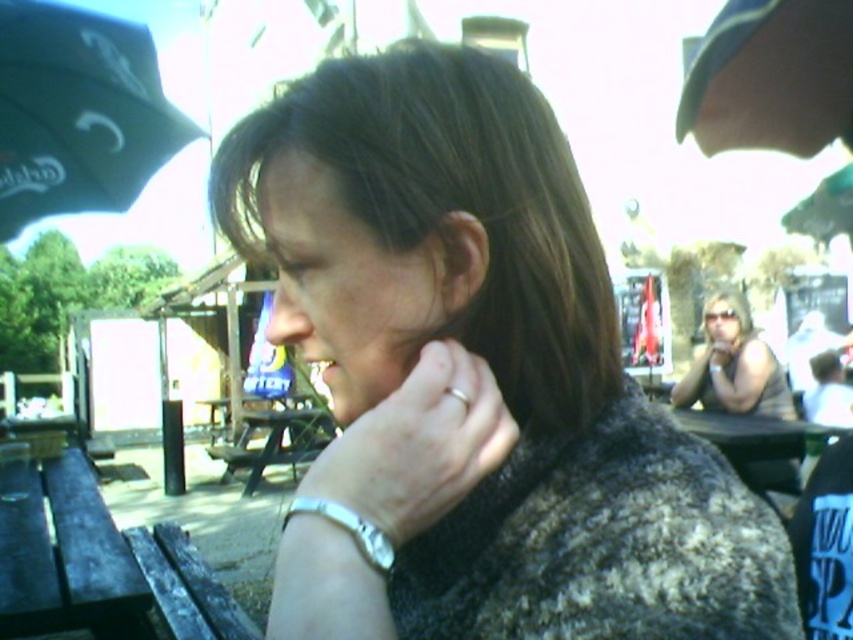
You are a photographer trying to capture a portrait of the person with dark brown hair at center. However, there is a black fabric umbrella at upper left in the frame. Based on their positions, which object should you move closer to the camera to ensure the person is the main focus?

The dark brown hair at center is to the right of the black fabric umbrella at upper left, so moving the dark brown hair at center closer to the camera would ensure it becomes the main focus.

You are taking a photo of the person with dark brown hair at center. If you want to focus on their hair, where should you aim your camera? Please provide coordinates in the format of x,y.

The dark brown hair at center is located at coordinates (477, 378), so you should aim your camera at that point to focus on their hair.